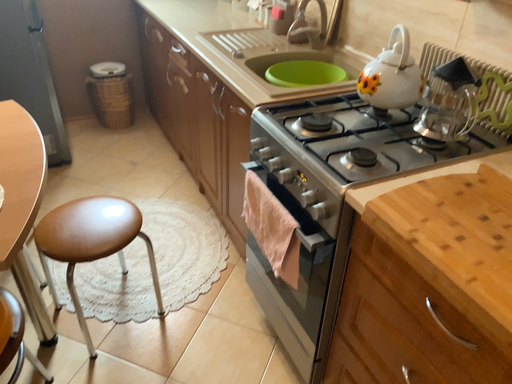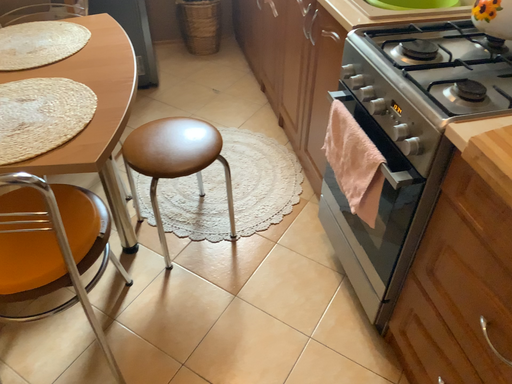
Question: Which way did the camera rotate in the video?

Choices:
 (A) rotated upward
 (B) rotated downward

Answer: (B)